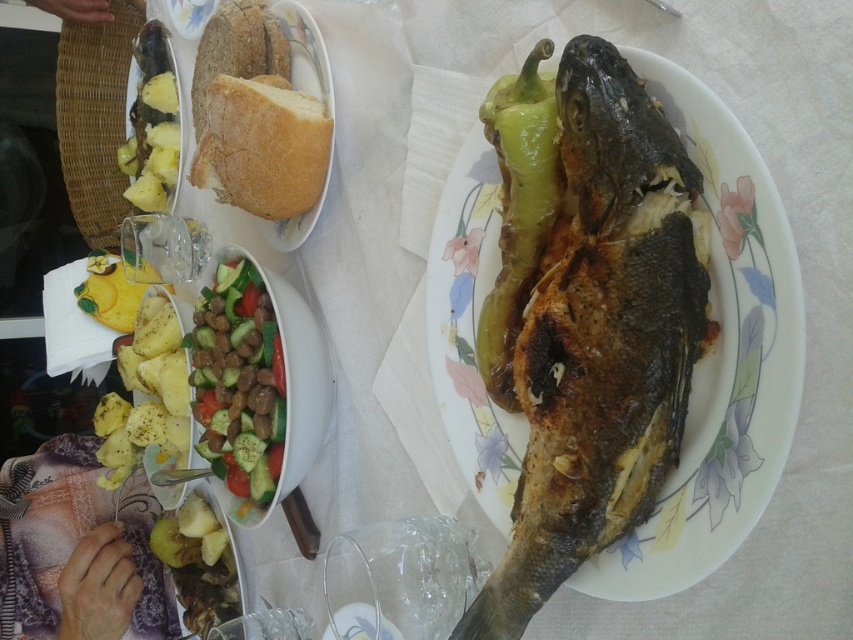
Looking at this image, you are a guest at the table and want to reach for the brown crispy fish at center and the yellowish matte pineapple at left. Which one is closer to your left side?

The yellowish matte pineapple at left is closer to your left side since it is positioned to the left of the brown crispy fish at center.

Looking at this image, you are a waiter who needs to place a 30 inch long tray between the green matte pepper at center and the yellowish matte pineapple at left. Can the tray fit without overlapping either object?

The distance between the green matte pepper at center and the yellowish matte pineapple at left is 28.92 inches. Since the tray is 30 inches long, it cannot fit between them without overlapping one of the objects.

In the scene shown: You are a chef preparing to plate a new dish. You have a brown crispy fish at center and bread at upper left. Which object is wider?

The brown crispy fish at center is wider than the bread at upper left according to the description.